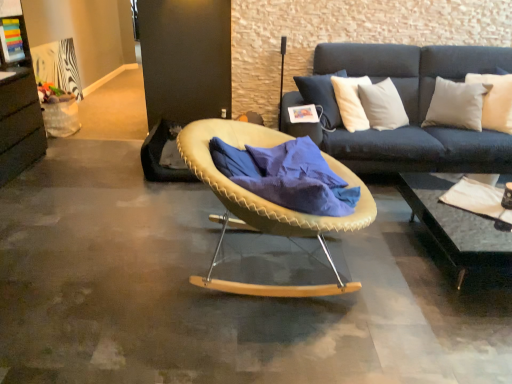
Image resolution: width=512 pixels, height=384 pixels. Identify the location of black glass coffee table at lower right. 456,226.

This screenshot has height=384, width=512. I want to click on black glass coffee table at lower right, so click(x=456, y=226).

Would you say black glass coffee table at lower right is to the left or to the right of white soft cushion at upper right in the picture?

In the image, black glass coffee table at lower right appears on the left side of white soft cushion at upper right.

Between black glass coffee table at lower right and white soft cushion at upper right, which one has smaller width?

Thinner between the two is white soft cushion at upper right.

Which of these two, black glass coffee table at lower right or white soft cushion at upper right, stands shorter?

Standing shorter between the two is black glass coffee table at lower right.

From the image's perspective, relative to white soft cushion at upper right, is black glass coffee table at lower right above or below?

Based on their image positions, black glass coffee table at lower right is located beneath white soft cushion at upper right.

In the image, is beige woven chair at center positioned in front of or behind blue soft fabric at center?

beige woven chair at center is in front of blue soft fabric at center.

Does point (328, 251) appear closer or farther from the camera than point (347, 212)?

Point (328, 251) is farther from the camera than point (347, 212).

Choose the correct answer: Is beige woven chair at center inside blue soft fabric at center or outside it?

beige woven chair at center lies outside blue soft fabric at center.

Can you confirm if black glass coffee table at lower right is positioned to the left of blue soft fabric at center?

Incorrect, black glass coffee table at lower right is not on the left side of blue soft fabric at center.

At what (x,y) coordinates should I click in order to perform the action: click on blanket lying in front of the black glass coffee table at lower right. Please return your answer as a coordinate pair (x, y). The height and width of the screenshot is (384, 512). Looking at the image, I should click on (287, 176).

Considering the sizes of black glass coffee table at lower right and blue soft fabric at center in the image, is black glass coffee table at lower right taller or shorter than blue soft fabric at center?

In the image, black glass coffee table at lower right appears to be shorter than blue soft fabric at center.

Between point (312, 188) and point (456, 241), which one is positioned behind?

The point (456, 241) is more distant.

From a real-world perspective, which object rests below the other?

In real-world perspective, black glass coffee table at lower right is lower.

From the image's perspective, is blue soft fabric at center above or below black glass coffee table at lower right?

Based on their image positions, blue soft fabric at center is located above black glass coffee table at lower right.

Which is correct: blue soft fabric at center is inside black glass coffee table at lower right, or outside of it?

blue soft fabric at center is not inside black glass coffee table at lower right, it's outside.

From the image's perspective, is white soft cushion at upper right on top of black glass coffee table at lower right?

Correct, white soft cushion at upper right appears higher than black glass coffee table at lower right in the image.

How much distance is there between white soft cushion at upper right and black glass coffee table at lower right?

A distance of 1.07 meters exists between white soft cushion at upper right and black glass coffee table at lower right.

In terms of height, does white soft cushion at upper right look taller or shorter compared to black glass coffee table at lower right?

In the image, white soft cushion at upper right appears to be taller than black glass coffee table at lower right.

Is white soft cushion at upper right not within black glass coffee table at lower right?

Yes, white soft cushion at upper right is not within black glass coffee table at lower right.

Would you say beige woven chair at center is outside black glass coffee table at lower right?

Yes, beige woven chair at center is not within black glass coffee table at lower right.

Which is in front, beige woven chair at center or black glass coffee table at lower right?

beige woven chair at center.

From the image's perspective, between beige woven chair at center and black glass coffee table at lower right, who is located below?

black glass coffee table at lower right appears lower in the image.

Looking at their sizes, would you say beige woven chair at center is wider or thinner than black glass coffee table at lower right?

In the image, beige woven chair at center appears to be more narrow than black glass coffee table at lower right.

In the image, is beige woven chair at center positioned in front of or behind white soft cushion at upper right?

In the image, beige woven chair at center appears in front of white soft cushion at upper right.

Can you tell me how much beige woven chair at center and white soft cushion at upper right differ in facing direction?

beige woven chair at center and white soft cushion at upper right are facing 167 degrees away from each other.

Considering the relative positions of beige woven chair at center and white soft cushion at upper right in the image provided, is beige woven chair at center to the right of white soft cushion at upper right from the viewer's perspective?

Incorrect, beige woven chair at center is not on the right side of white soft cushion at upper right.

Measure the distance from beige woven chair at center to white soft cushion at upper right.

beige woven chair at center and white soft cushion at upper right are 2.02 meters apart from each other.

What are the coordinates of `coffee table in front of the white soft cushion at upper right` in the screenshot? It's located at (456, 226).

You are a GUI agent. You are given a task and a screenshot of the screen. Output one action in this format:
    pyautogui.click(x=<x>, y=<y>)
    Task: Click on the chair located on the left of blue soft fabric at center
    The height and width of the screenshot is (384, 512).
    Given the screenshot: What is the action you would take?
    [266, 205]

Which object lies further to the anchor point beige woven chair at center, black glass coffee table at lower right or blue soft fabric at center?

black glass coffee table at lower right.

From the image, which object appears to be farther from blue soft fabric at center, white soft cushion at upper right or beige woven chair at center?

Based on the image, white soft cushion at upper right appears to be further to blue soft fabric at center.

When comparing their distances from beige woven chair at center, does blue soft fabric at center or white soft cushion at upper right seem closer?

blue soft fabric at center is closer to beige woven chair at center.

Based on their spatial positions, is beige woven chair at center or black glass coffee table at lower right further from white soft cushion at upper right?

beige woven chair at center.

Looking at the image, which one is located closer to beige woven chair at center, black glass coffee table at lower right or white soft cushion at upper right?

black glass coffee table at lower right lies closer to beige woven chair at center than the other object.

Which object lies nearer to the anchor point black glass coffee table at lower right, blue soft fabric at center or beige woven chair at center?

blue soft fabric at center lies closer to black glass coffee table at lower right than the other object.

From the image, which object appears to be nearer to black glass coffee table at lower right, beige woven chair at center or blue soft fabric at center?

blue soft fabric at center lies closer to black glass coffee table at lower right than the other object.

Consider the image. Considering their positions, is white soft cushion at upper right positioned closer to beige woven chair at center than black glass coffee table at lower right?

Among the two, black glass coffee table at lower right is located nearer to beige woven chair at center.

This screenshot has height=384, width=512. What are the coordinates of `coffee table located between beige woven chair at center and white soft cushion at upper right in the left-right direction` in the screenshot? It's located at (456, 226).

I want to click on coffee table between blue soft fabric at center and white soft cushion at upper right in the horizontal direction, so click(x=456, y=226).

This screenshot has height=384, width=512. I want to click on blanket situated between beige woven chair at center and white soft cushion at upper right from left to right, so click(x=287, y=176).

This screenshot has width=512, height=384. In order to click on blanket between beige woven chair at center and black glass coffee table at lower right in this screenshot , I will do `click(287, 176)`.